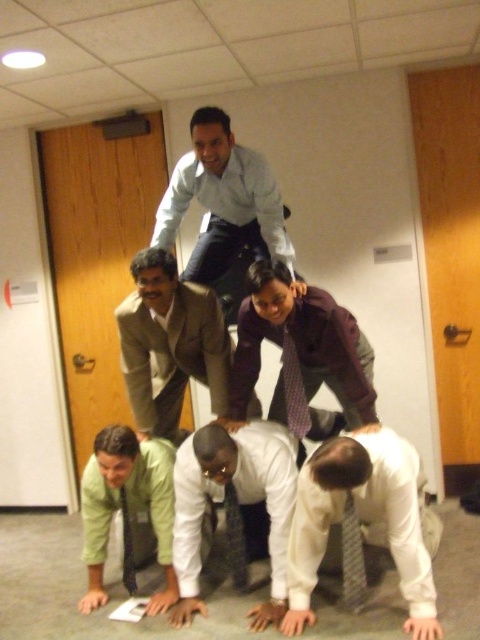
In the scene shown: You are a photographer setting up a shoot in the conference room. You need to position a light source to ensure both the green fabric shirt at lower left and the dark purple textured tie at center are well lit. Given their heights, where should you place the light source to avoid shadows on both?

The green fabric shirt at lower left is much taller than the dark purple textured tie at center. To avoid shadows on both, place the light source above and between them so it can illuminate both the taller green fabric shirt at lower left and the shorter dark purple textured tie at center effectively.

You are standing in the conference room and want to take a photo of the human pyramid. You notice the green fabric shirt at lower left and the dark purple textured tie at center. Which object is positioned closer to you?

The green fabric shirt at lower left is closer to the viewer than the dark purple textured tie at center.